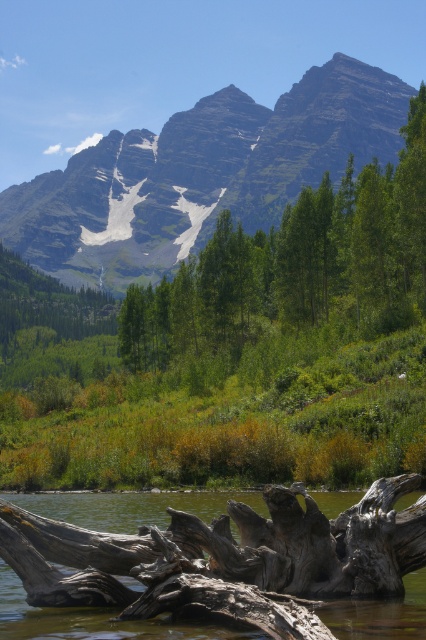
Between green grassy mountain at upper center and gray wood log at lower center, which one is positioned lower?

Positioned lower is gray wood log at lower center.

Does green grassy mountain at upper center have a lesser height compared to gray wood log at lower center?

In fact, green grassy mountain at upper center may be taller than gray wood log at lower center.

You are a GUI agent. You are given a task and a screenshot of the screen. Output one action in this format:
    pyautogui.click(x=<x>, y=<y>)
    Task: Click on the green grassy mountain at upper center
    The image size is (426, 640).
    Given the screenshot: What is the action you would take?
    pyautogui.click(x=199, y=173)

Locate an element on the screen. This screenshot has height=640, width=426. green grassy mountain at upper center is located at coordinates (199, 173).